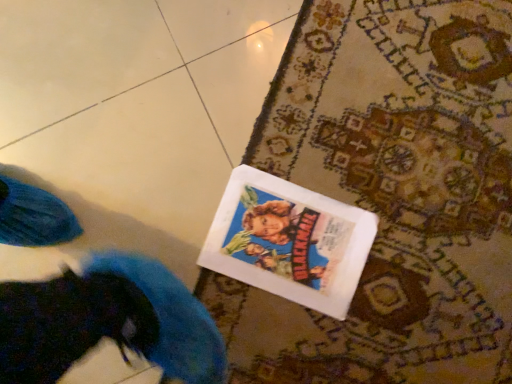
What do you see at coordinates (391, 194) in the screenshot? This screenshot has width=512, height=384. I see `carpeted mat at lower right` at bounding box center [391, 194].

From the picture: Measure the distance between carpeted mat at lower right and camera.

A distance of 31.16 inches exists between carpeted mat at lower right and camera.

The image size is (512, 384). What are the coordinates of `carpeted mat at lower right` in the screenshot? It's located at (391, 194).

At what (x,y) coordinates should I click in order to perform the action: click on carpeted mat at lower right. Please return your answer as a coordinate pair (x, y). The height and width of the screenshot is (384, 512). Looking at the image, I should click on (391, 194).